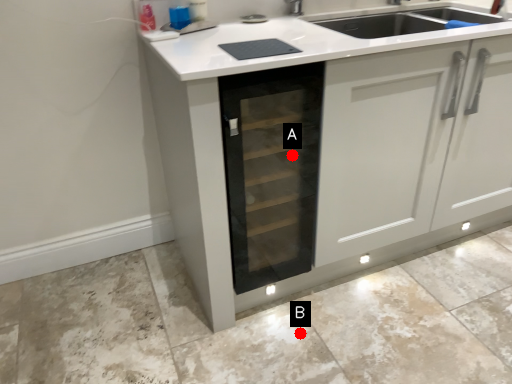
Question: Two points are circled on the image, labeled by A and B beside each circle. Which point appears closest to the camera in this image?

Choices:
 (A) A is closer
 (B) B is closer

Answer: (A)